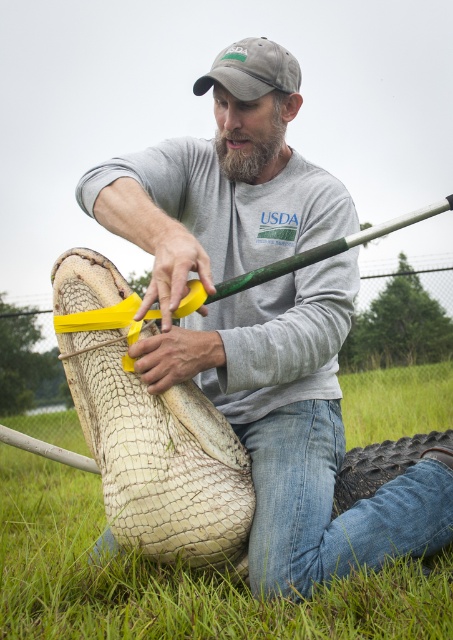
Looking at this image, you are a wildlife researcher observing the scene. You need to determine which object is bigger between the leather textured boot at center and the gray fabric cap at upper center. Which one is larger?

The leather textured boot at center is larger in size than the gray fabric cap at upper center.

You are a photographer trying to capture a clear photo of the gray fabric cap at upper center and the leather textured boot at center. Since you can only focus on one object at a time, which object should you focus on to ensure the other is still in the frame?

The leather textured boot at center is positioned on the left side of gray fabric cap at upper center, so focusing on the gray fabric cap at upper center would keep the leather textured boot at center in the frame as it is to the left.